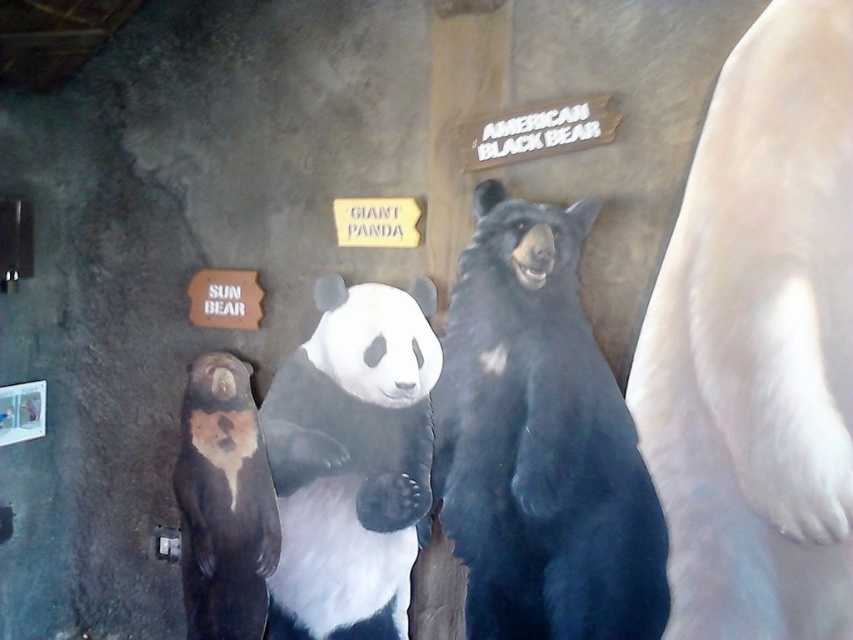
Question: Is white matte panda at center thinner than brown matte sun bear at left?

Choices:
 (A) no
 (B) yes

Answer: (A)

Question: Is black furry bear at center smaller than brown matte sun bear at left?

Choices:
 (A) yes
 (B) no

Answer: (B)

Question: Considering the real-world distances, which object is closest to the white matte panda at center?

Choices:
 (A) black furry bear at center
 (B) brown matte sun bear at left

Answer: (B)

Question: Estimate the real-world distances between objects in this image. Which object is closer to the white matte panda at center?

Choices:
 (A) black furry bear at center
 (B) brown matte sun bear at left

Answer: (B)

Question: Is white matte panda at center to the left of brown matte sun bear at left from the viewer's perspective?

Choices:
 (A) yes
 (B) no

Answer: (B)

Question: Which of the following is the farthest from the observer?

Choices:
 (A) (476, 394)
 (B) (260, 620)
 (C) (291, 493)

Answer: (B)